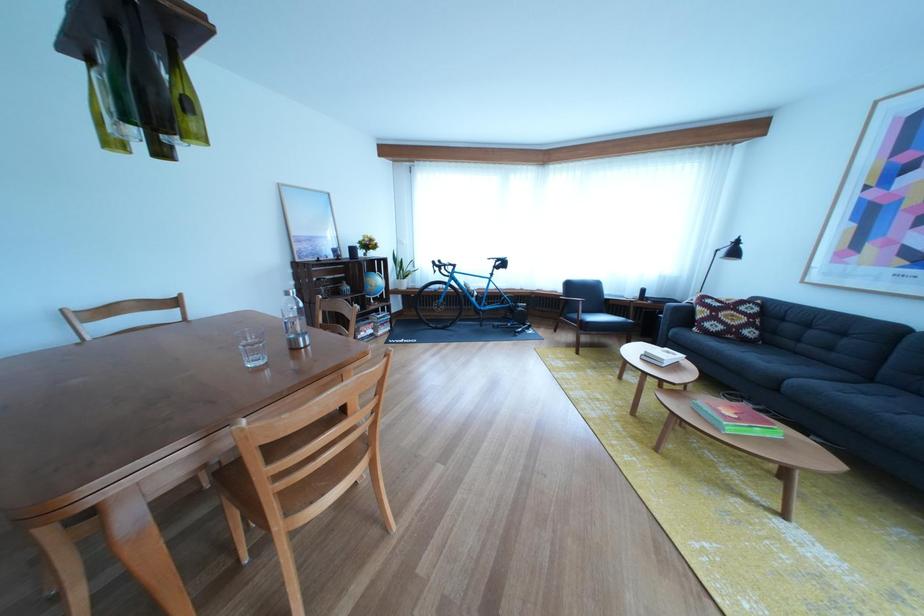
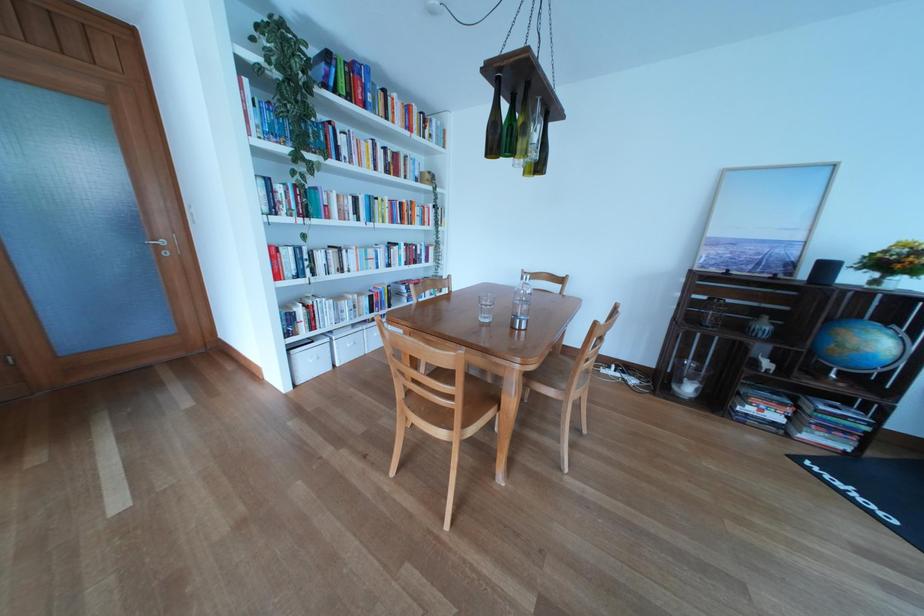
Where in the second image is the point corresponding to point 359,262 from the first image?

(816, 282)